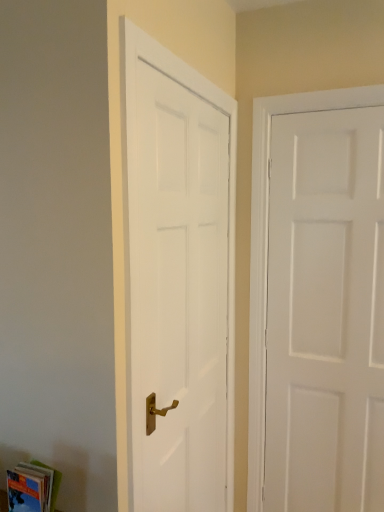
Question: Is hardcover book at lower left far away from white matte door at right, the 2th door viewed from the left?

Choices:
 (A) yes
 (B) no

Answer: (A)

Question: From a real-world perspective, is hardcover book at lower left located beneath white matte door at right, the 1th door in the right-to-left sequence?

Choices:
 (A) yes
 (B) no

Answer: (A)

Question: Does hardcover book at lower left have a lesser height compared to white matte door at right, the 1th door in the right-to-left sequence?

Choices:
 (A) yes
 (B) no

Answer: (A)

Question: Is hardcover book at lower left facing towards white matte door at right, the 2th door viewed from the left?

Choices:
 (A) yes
 (B) no

Answer: (B)

Question: From a real-world perspective, is hardcover book at lower left on white matte door at right, the 2th door viewed from the left?

Choices:
 (A) yes
 (B) no

Answer: (B)

Question: From the image's perspective, is hardcover book at lower left located above or below white smooth door at left, which is counted as the second door, starting from the right?

Choices:
 (A) above
 (B) below

Answer: (B)

Question: Is hardcover book at lower left situated inside white smooth door at left, which is counted as the second door, starting from the right, or outside?

Choices:
 (A) outside
 (B) inside

Answer: (A)

Question: Is hardcover book at lower left in front of or behind white smooth door at left, which is counted as the second door, starting from the right, in the image?

Choices:
 (A) front
 (B) behind

Answer: (A)

Question: Considering the positions of hardcover book at lower left and white smooth door at left, which is counted as the second door, starting from the right, in the image, is hardcover book at lower left taller or shorter than white smooth door at left, which is counted as the second door, starting from the right,?

Choices:
 (A) short
 (B) tall

Answer: (A)

Question: In terms of size, does white matte door at right, the 2th door viewed from the left, appear bigger or smaller than white smooth door at left, placed as the 1th door when sorted from left to right?

Choices:
 (A) small
 (B) big

Answer: (A)

Question: Is white matte door at right, the 1th door in the right-to-left sequence, wider or thinner than white smooth door at left, placed as the 1th door when sorted from left to right?

Choices:
 (A) wide
 (B) thin

Answer: (A)

Question: Does point (306, 461) appear closer or farther from the camera than point (160, 387)?

Choices:
 (A) farther
 (B) closer

Answer: (A)

Question: From a real-world perspective, is white matte door at right, the 2th door viewed from the left, positioned above or below white smooth door at left, which is counted as the second door, starting from the right?

Choices:
 (A) above
 (B) below

Answer: (B)

Question: In terms of height, does white matte door at right, the 2th door viewed from the left, look taller or shorter compared to hardcover book at lower left?

Choices:
 (A) tall
 (B) short

Answer: (A)

Question: In terms of size, does white matte door at right, the 1th door in the right-to-left sequence, appear bigger or smaller than hardcover book at lower left?

Choices:
 (A) big
 (B) small

Answer: (A)